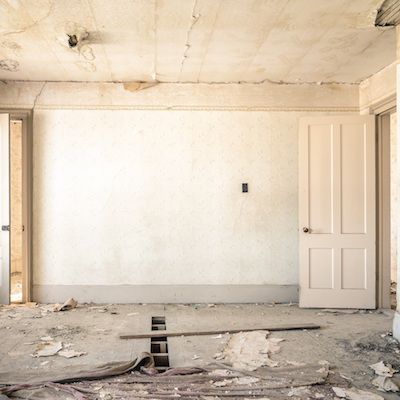
Where is `cracks in ceiling`? The height and width of the screenshot is (400, 400). cracks in ceiling is located at coordinates (41, 94), (186, 45).